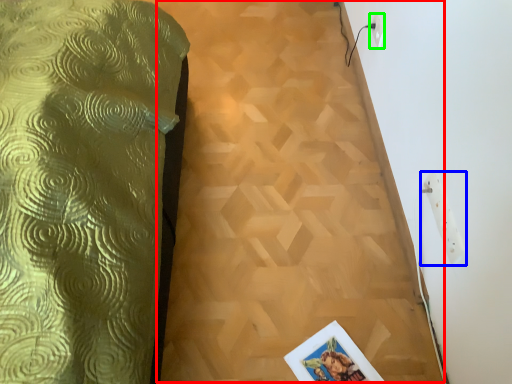
Question: Which is nearer to the plywood (highlighted by a red box)? electric outlet (highlighted by a blue box) or electric outlet (highlighted by a green box).

Choices:
 (A) electric outlet
 (B) electric outlet

Answer: (A)